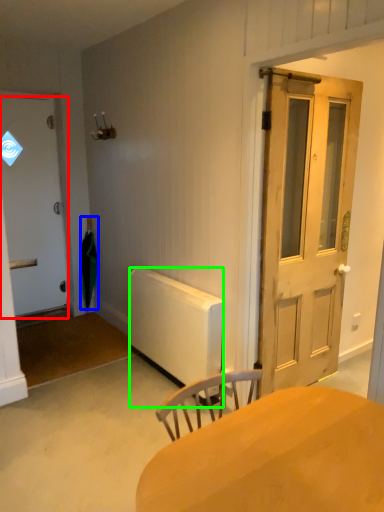
Question: Considering the real-world distances, which object is closest to door (highlighted by a red box)? umbrella (highlighted by a blue box) or radiator (highlighted by a green box).

Choices:
 (A) umbrella
 (B) radiator

Answer: (A)